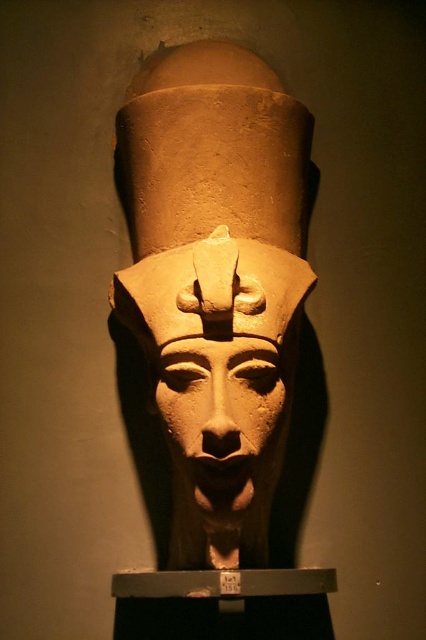
You are an archaeologist examining the sculpture. You notice two parts of the sculpture labeled as the matte clay head at center and the matte stone face at center. Which part of the sculpture is taller?

The matte clay head at center is taller than the matte stone face at center according to the description provided.

Looking at this image, you are an archaeologist examining the sculpture. You need to place a protective cover over both the matte clay head at center and the matte stone face at center. What is the minimum length of the cover required to cover both objects?

The minimum length of the cover should be at least 4.37 inches to accommodate the distance between the matte clay head at center and the matte stone face at center.